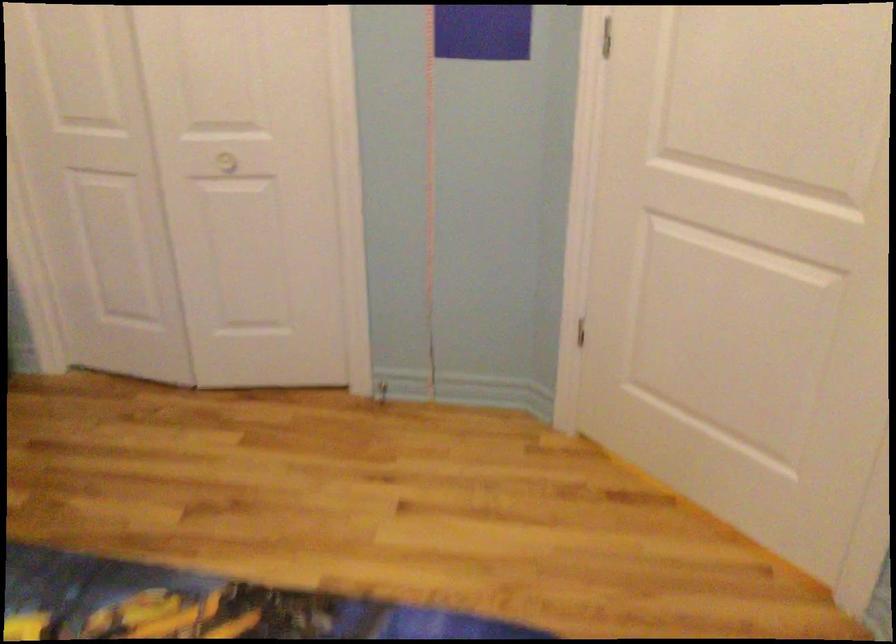
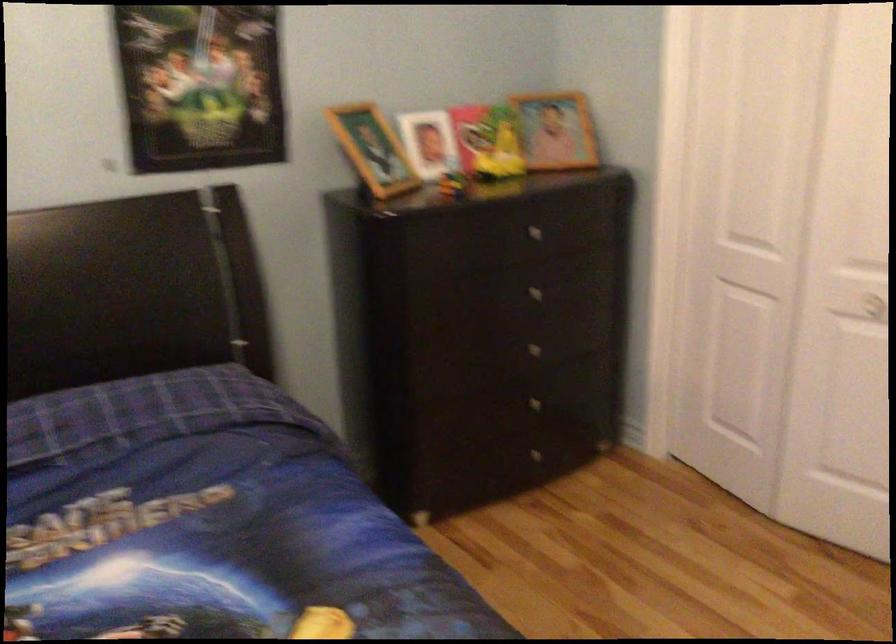
Where in the second image is the point corresponding to (x=211, y=166) from the first image?

(864, 305)